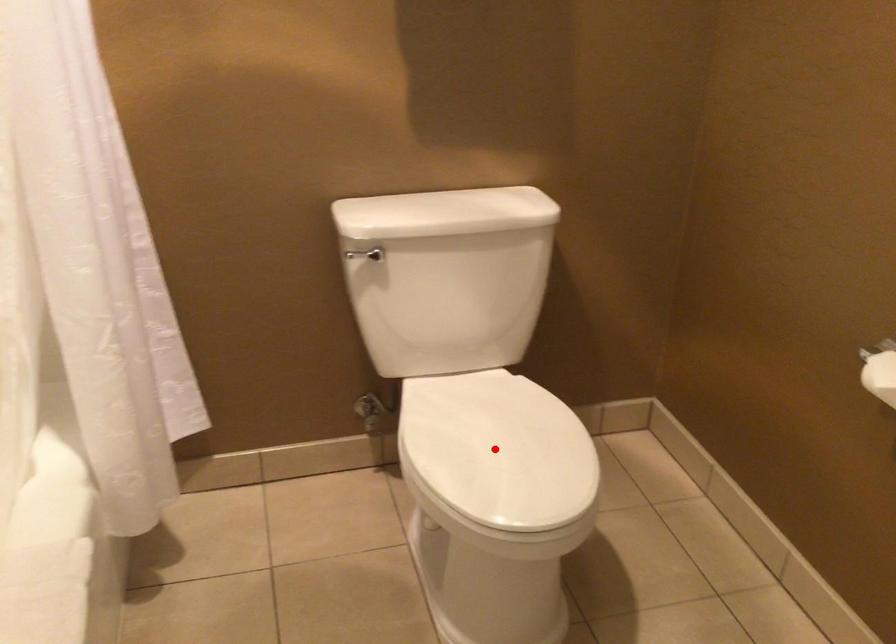
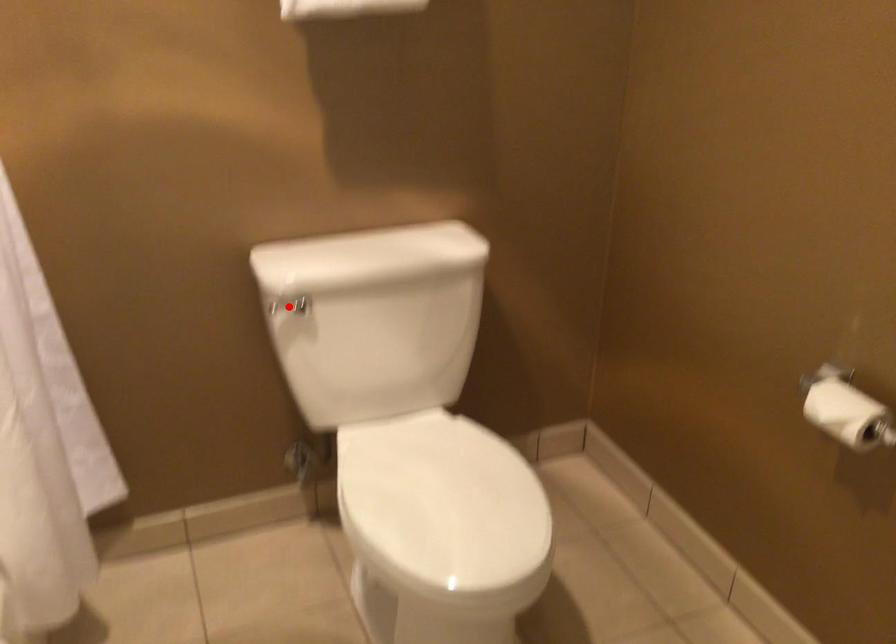
I am providing you with two images of the same scene from different viewpoints. A red point is marked on the first image and another point is marked on the second image. Is the marked point in image1 the same physical position as the marked point in image2?

No